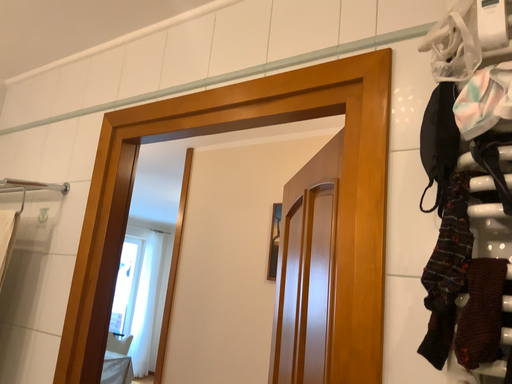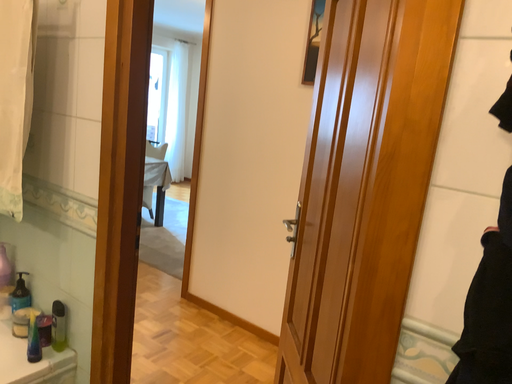
Question: Which way did the camera rotate in the video?

Choices:
 (A) rotated downward
 (B) rotated upward

Answer: (A)